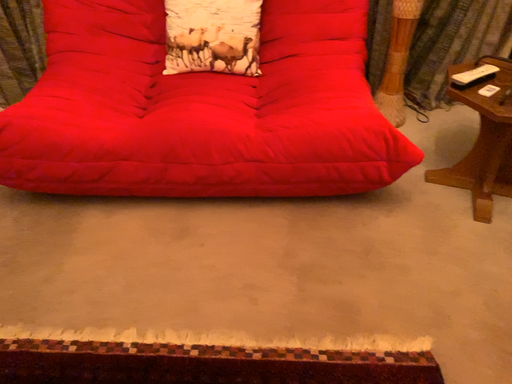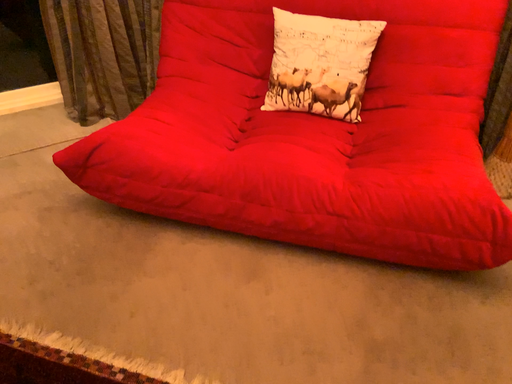
Question: Which way did the camera rotate in the video?

Choices:
 (A) rotated right
 (B) rotated left

Answer: (B)